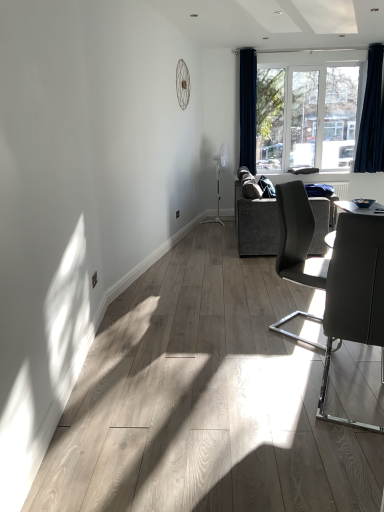
Find the location of `free space in front of matte gray chair at right, the second chair when ordered from back to front`. free space in front of matte gray chair at right, the second chair when ordered from back to front is located at coordinates (338, 454).